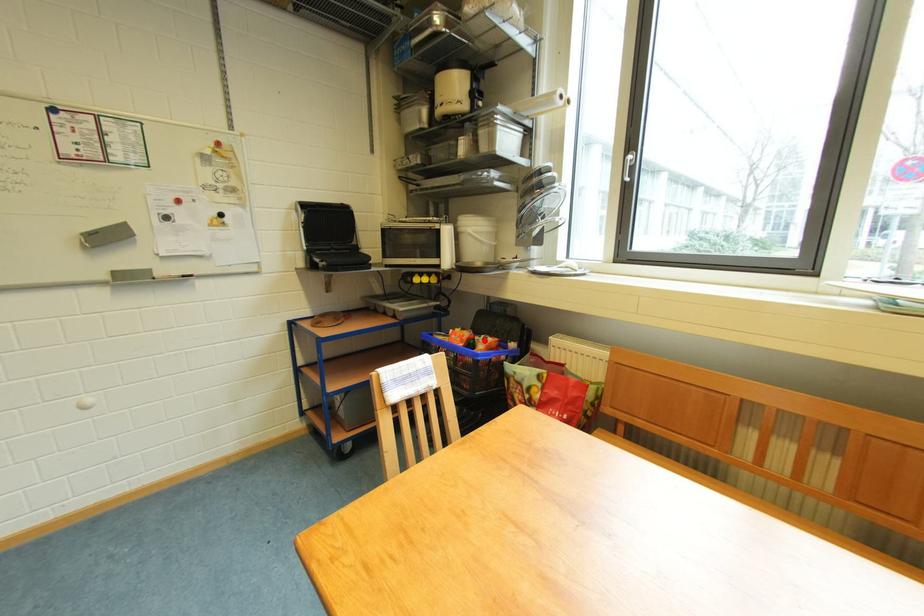
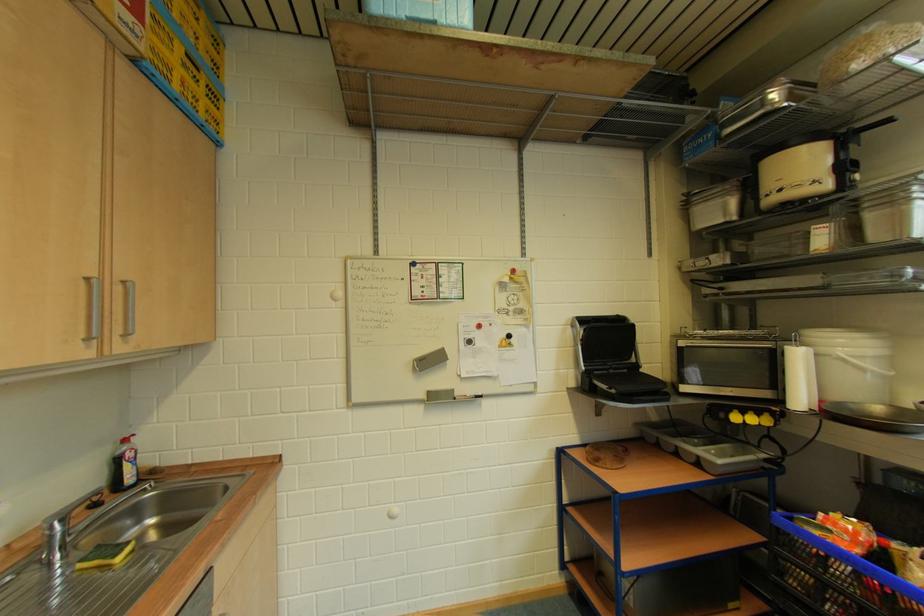
Locate, in the second image, the point that corresponds to the highlighted location in the first image.

(905, 549)